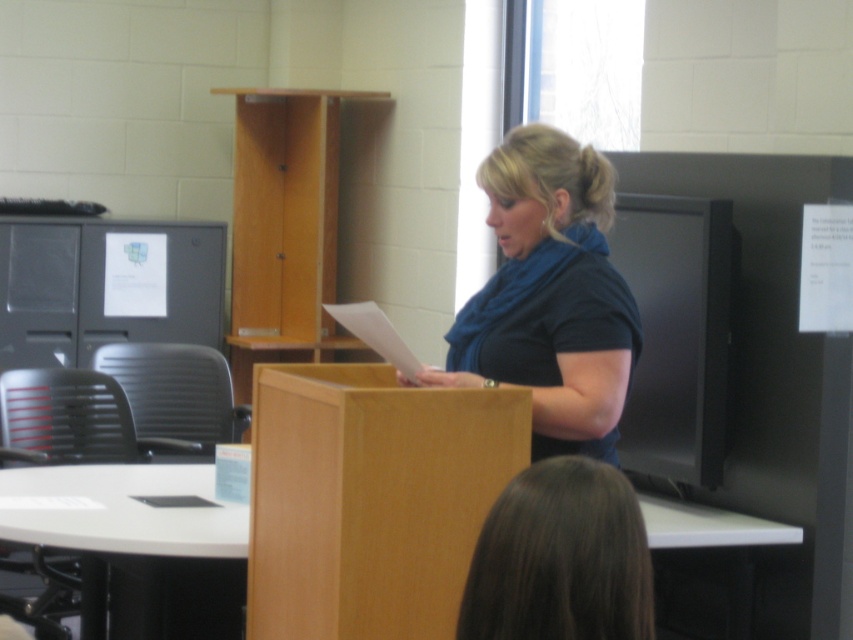
Question: Which object appears farthest from the camera in this image?

Choices:
 (A) blue matte scarf at center
 (B) brown hair at lower center

Answer: (A)

Question: Is blue matte scarf at center in front of brown hair at lower center?

Choices:
 (A) yes
 (B) no

Answer: (B)

Question: Does blue matte scarf at center appear over brown hair at lower center?

Choices:
 (A) yes
 (B) no

Answer: (A)

Question: Which point appears closest to the camera in this image?

Choices:
 (A) tap(492, 324)
 (B) tap(567, 513)

Answer: (B)

Question: Which point is farther from the camera taking this photo?

Choices:
 (A) (566, 605)
 (B) (599, 358)

Answer: (B)

Question: Does blue matte scarf at center have a larger size compared to brown hair at lower center?

Choices:
 (A) yes
 (B) no

Answer: (A)